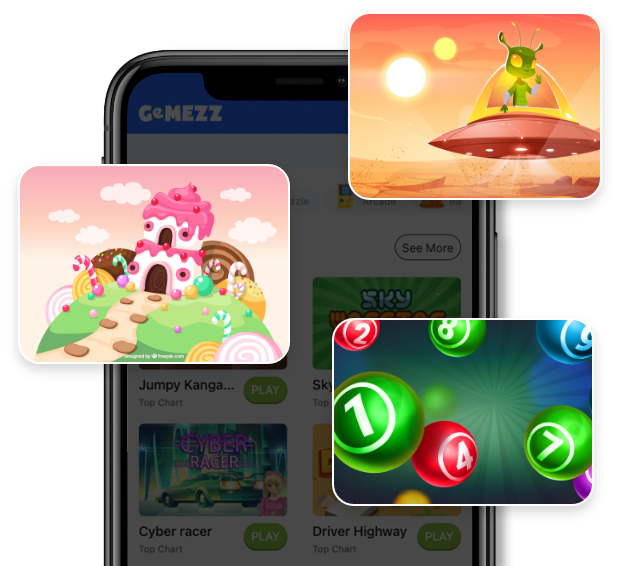
The height and width of the screenshot is (566, 620). I want to click on phone, so click(x=276, y=450).